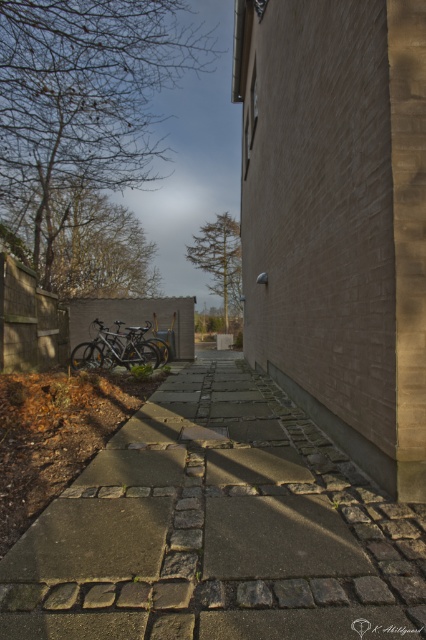
Question: Is stone paved walkway at center bigger than shiny metallic bicycle at center?

Choices:
 (A) no
 (B) yes

Answer: (A)

Question: Among these points, which one is farthest from the camera?

Choices:
 (A) (124, 326)
 (B) (163, 492)

Answer: (A)

Question: Can you confirm if stone paved walkway at center is positioned below shiny metallic bicycle at center?

Choices:
 (A) yes
 (B) no

Answer: (A)

Question: Can you confirm if stone paved walkway at center is thinner than shiny metallic bicycle at center?

Choices:
 (A) yes
 (B) no

Answer: (A)